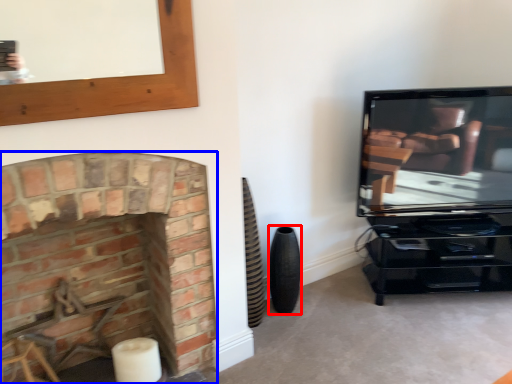
Question: Which object appears farthest to the camera in this image, speaker (highlighted by a red box) or fireplace (highlighted by a blue box)?

Choices:
 (A) speaker
 (B) fireplace

Answer: (A)